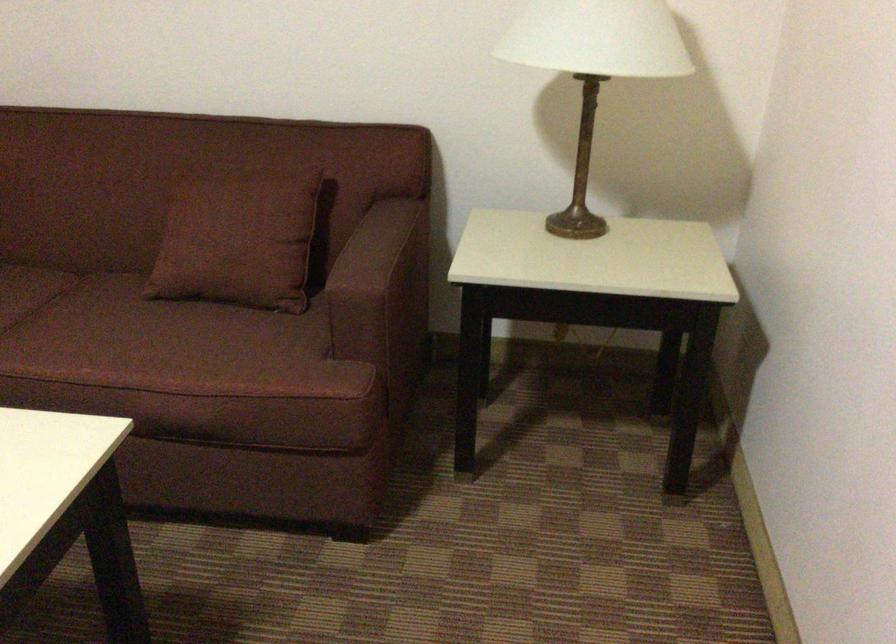
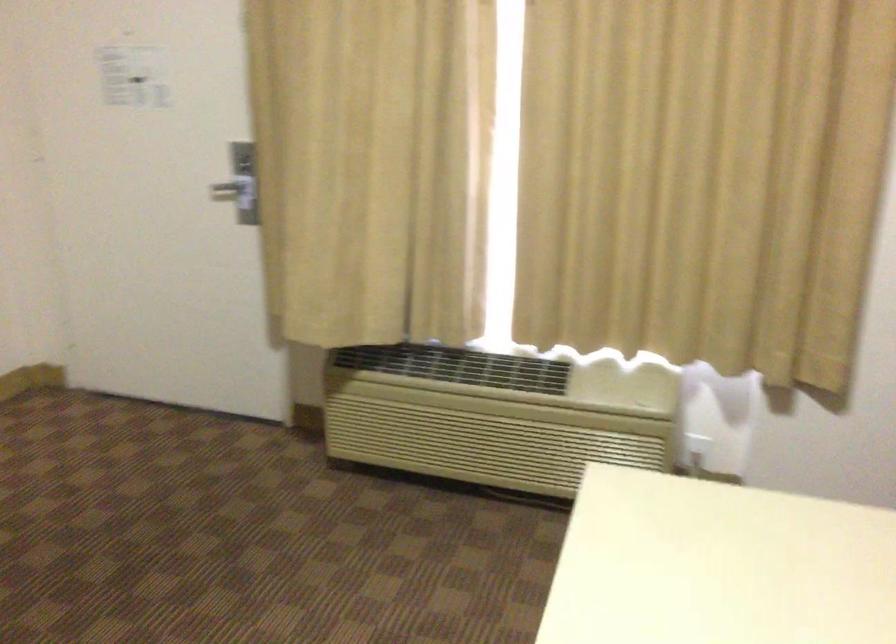
How did the camera likely rotate?

The rotation direction of the camera is left-down.